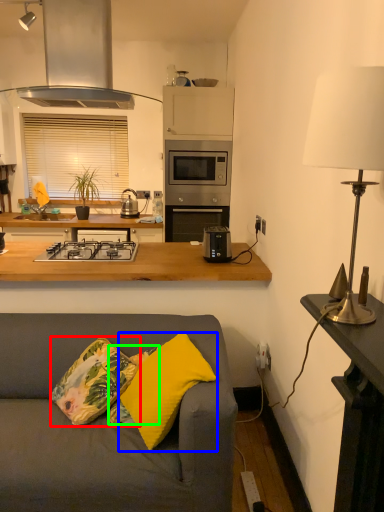
Question: Which object is the farthest from throw pillow (highlighted by a red box)? Choose among these: pillow (highlighted by a blue box) or pillow (highlighted by a green box).

Choices:
 (A) pillow
 (B) pillow

Answer: (A)